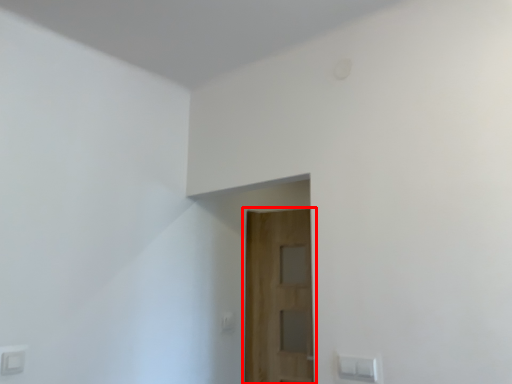
Question: Observing the image, what is the correct spatial positioning of door (annotated by the red box) in reference to light switch?

Choices:
 (A) right
 (B) left

Answer: (A)